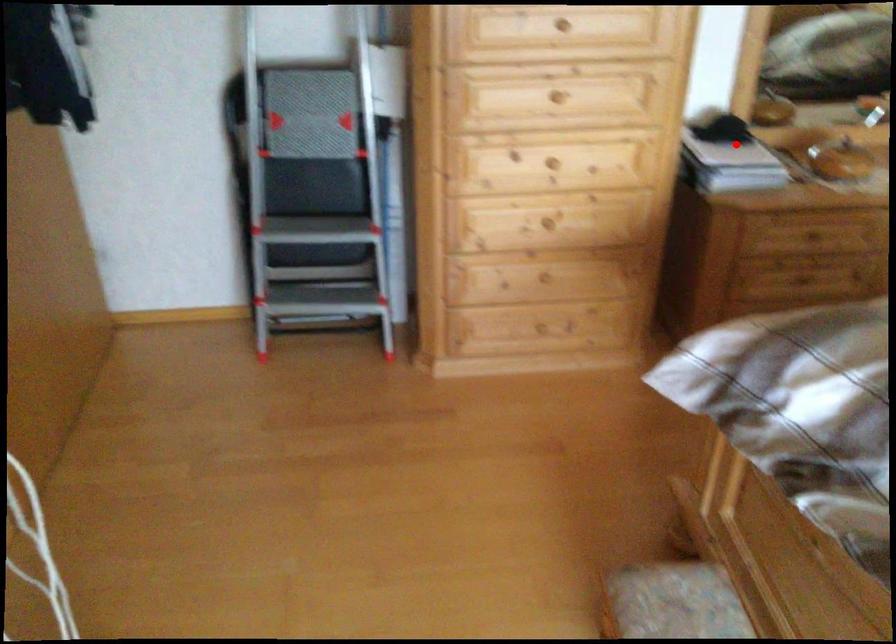
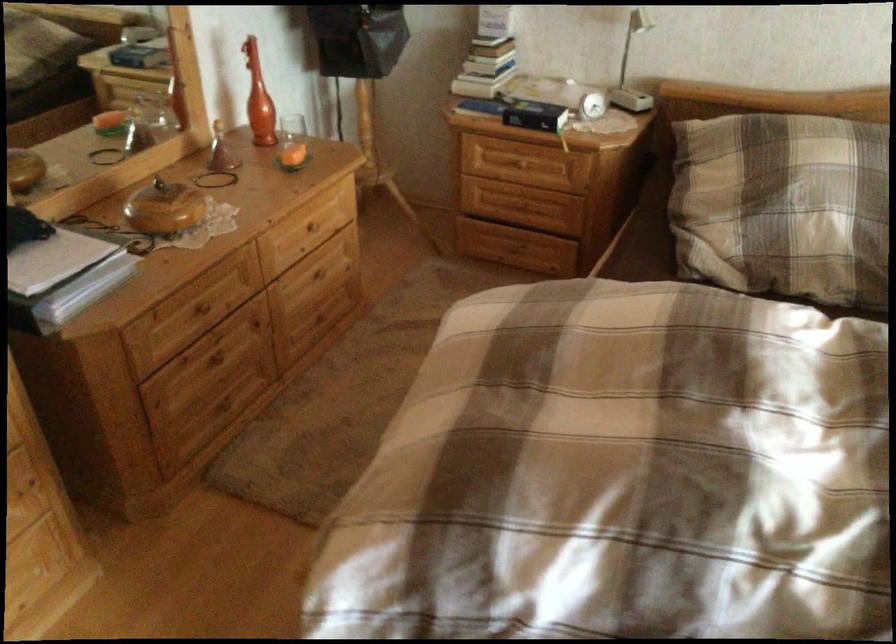
Find the pixel in the second image that matches the highlighted location in the first image.

(55, 260)